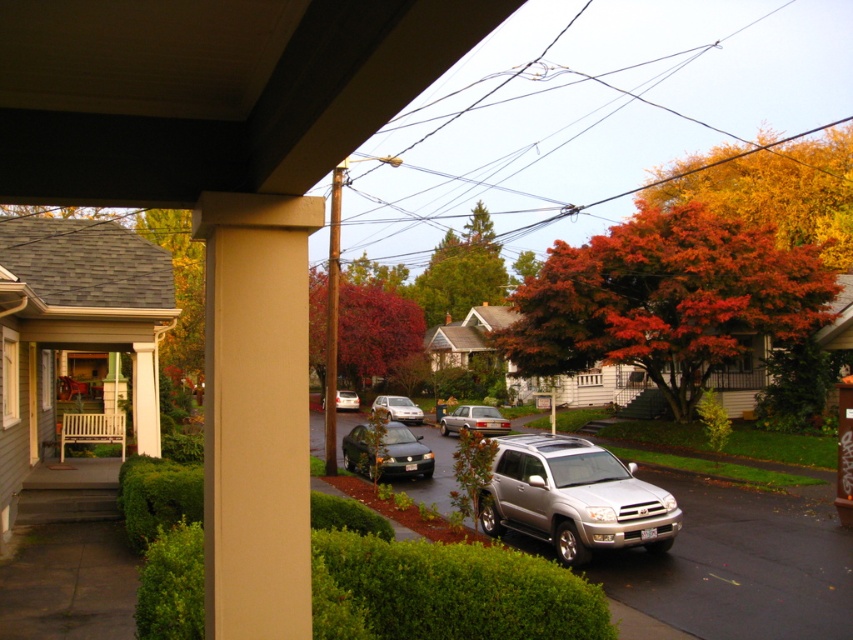
Is metallic silver sedan at center positioned before satin silver sedan at center?

Yes, metallic silver sedan at center is closer to the viewer.

Does metallic silver sedan at center have a greater height compared to satin silver sedan at center?

In fact, metallic silver sedan at center may be shorter than satin silver sedan at center.

Which is behind, point (460, 428) or point (410, 412)?

The point (410, 412) is behind.

Locate an element on the screen. Image resolution: width=853 pixels, height=640 pixels. metallic silver sedan at center is located at coordinates (474, 420).

Can you confirm if beige smooth column at center is positioned above orange leafy tree at upper right?

No, beige smooth column at center is not above orange leafy tree at upper right.

Image resolution: width=853 pixels, height=640 pixels. In order to click on beige smooth column at center in this screenshot , I will do `click(256, 412)`.

Who is more distant from viewer, (x=264, y=449) or (x=418, y=412)?

Point (x=418, y=412)

Who is more distant from viewer, (224, 291) or (379, 403)?

Point (379, 403)

I want to click on beige smooth column at center, so click(256, 412).